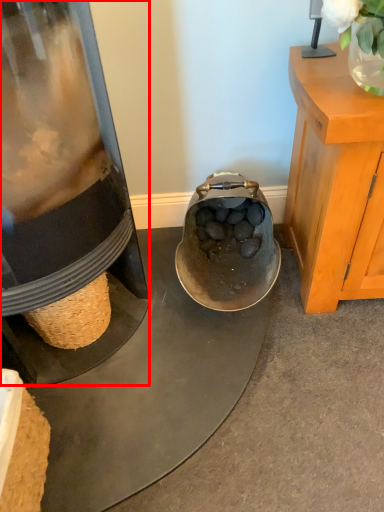
Question: Where is appliance (annotated by the red box) located in relation to plant in the image?

Choices:
 (A) left
 (B) right

Answer: (A)